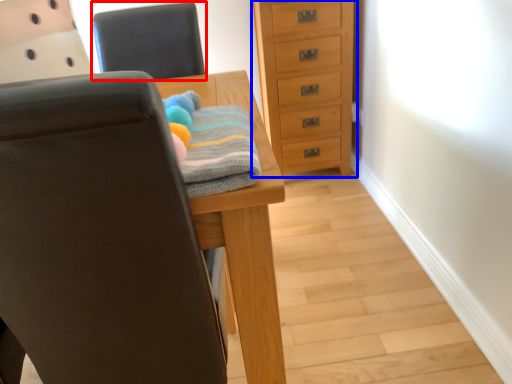
Question: Among these objects, which one is nearest to the camera, chair (highlighted by a red box) or chest of drawers (highlighted by a blue box)?

Choices:
 (A) chair
 (B) chest of drawers

Answer: (A)